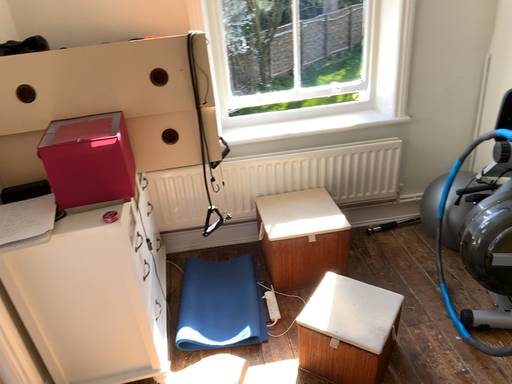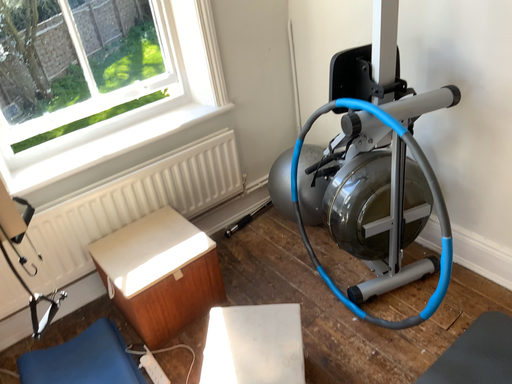
Question: How did the camera likely rotate when shooting the video?

Choices:
 (A) rotated left
 (B) rotated right

Answer: (B)